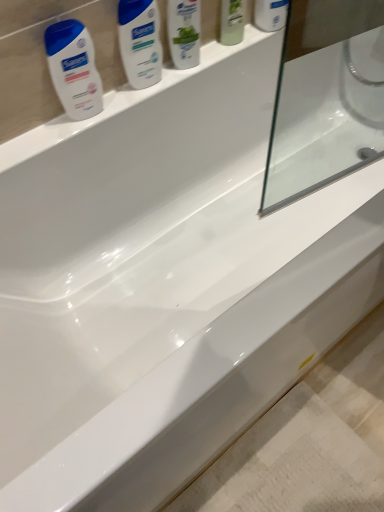
Question: Could you tell me if white glossy mouthwash at upper center, which is counted as the 1th mouthwash, starting from the right, is facing white glossy lotion at upper left, the first cleaning product viewed from the left?

Choices:
 (A) no
 (B) yes

Answer: (A)

Question: Is white glossy mouthwash at upper center, which is counted as the 1th mouthwash, starting from the right, looking in the opposite direction of white glossy lotion at upper left, the first cleaning product from the bottom?

Choices:
 (A) no
 (B) yes

Answer: (A)

Question: From a real-world perspective, is white glossy mouthwash at upper center, the second mouthwash in the left-to-right sequence, over white glossy lotion at upper left, marked as the 2th cleaning product in a right-to-left arrangement?

Choices:
 (A) yes
 (B) no

Answer: (A)

Question: From the image's perspective, would you say white glossy mouthwash at upper center, which is counted as the 1th mouthwash, starting from the right, is shown under white glossy lotion at upper left, the first cleaning product from the bottom?

Choices:
 (A) no
 (B) yes

Answer: (A)

Question: Considering the relative positions of white glossy mouthwash at upper center, which is counted as the 1th mouthwash, starting from the right, and white glossy lotion at upper left, marked as the 2th cleaning product in a right-to-left arrangement, in the image provided, is white glossy mouthwash at upper center, which is counted as the 1th mouthwash, starting from the right, behind white glossy lotion at upper left, marked as the 2th cleaning product in a right-to-left arrangement,?

Choices:
 (A) yes
 (B) no

Answer: (A)

Question: Is green matte mouthwash at upper center, placed as the 1th mouthwash when sorted from left to right, bigger or smaller than white glossy shampoo at upper center, positioned as the first cleaning product in top-to-bottom order?

Choices:
 (A) small
 (B) big

Answer: (A)

Question: Is point (231, 37) positioned closer to the camera than point (170, 40)?

Choices:
 (A) closer
 (B) farther

Answer: (B)

Question: From the image's perspective, is green matte mouthwash at upper center, placed as the 1th mouthwash when sorted from left to right, positioned above or below white glossy shampoo at upper center, which ranks as the 1th cleaning product in right-to-left order?

Choices:
 (A) above
 (B) below

Answer: (A)

Question: Would you say green matte mouthwash at upper center, placed as the 1th mouthwash when sorted from left to right, is to the left or to the right of white glossy shampoo at upper center, placed as the 2th cleaning product when sorted from bottom to top, in the picture?

Choices:
 (A) right
 (B) left

Answer: (A)

Question: Considering the positions of white glossy lotion at upper left, the first cleaning product from the bottom, and white glossy lotion at upper left in the image, is white glossy lotion at upper left, the first cleaning product from the bottom, wider or thinner than white glossy lotion at upper left?

Choices:
 (A) thin
 (B) wide

Answer: (A)

Question: In terms of height, does white glossy lotion at upper left, marked as the 2th cleaning product in a right-to-left arrangement, look taller or shorter compared to white glossy lotion at upper left?

Choices:
 (A) short
 (B) tall

Answer: (B)

Question: From a real-world perspective, is white glossy lotion at upper left, which ranks as the 2th cleaning product in top-to-bottom order, above or below white glossy lotion at upper left?

Choices:
 (A) below
 (B) above

Answer: (A)

Question: Would you say white glossy lotion at upper left, marked as the 2th cleaning product in a right-to-left arrangement, is to the left or to the right of white glossy lotion at upper left in the picture?

Choices:
 (A) right
 (B) left

Answer: (B)

Question: Is white glossy lotion at upper left, the first cleaning product viewed from the left, inside the boundaries of white glossy shampoo at upper center, positioned as the first cleaning product in top-to-bottom order, or outside?

Choices:
 (A) outside
 (B) inside

Answer: (A)

Question: In terms of width, does white glossy lotion at upper left, the first cleaning product from the bottom, look wider or thinner when compared to white glossy shampoo at upper center, placed as the 2th cleaning product when sorted from bottom to top?

Choices:
 (A) wide
 (B) thin

Answer: (B)